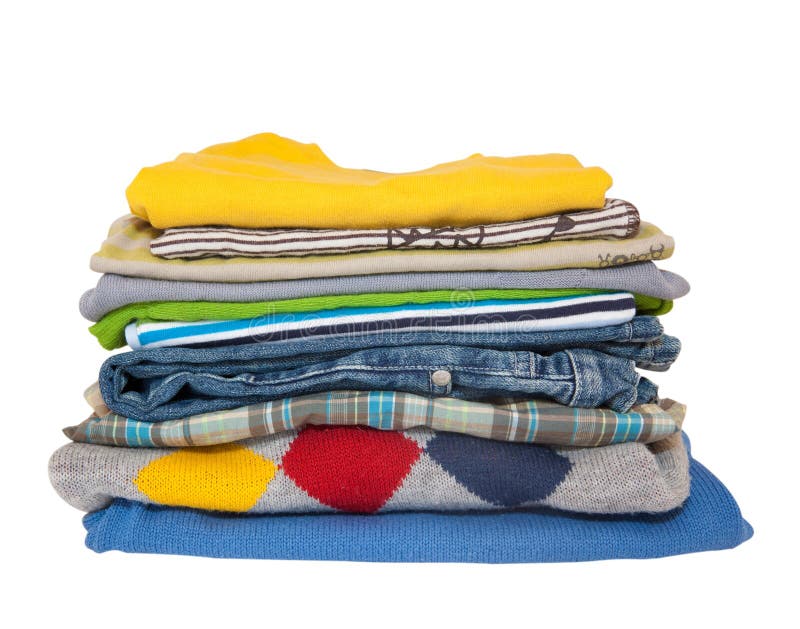
I want to click on folded clothes, so click(x=440, y=535), click(x=416, y=482), click(x=414, y=411), click(x=402, y=377), click(x=352, y=323), click(x=342, y=302), click(x=344, y=286), click(x=342, y=268), click(x=338, y=238), click(x=334, y=211).